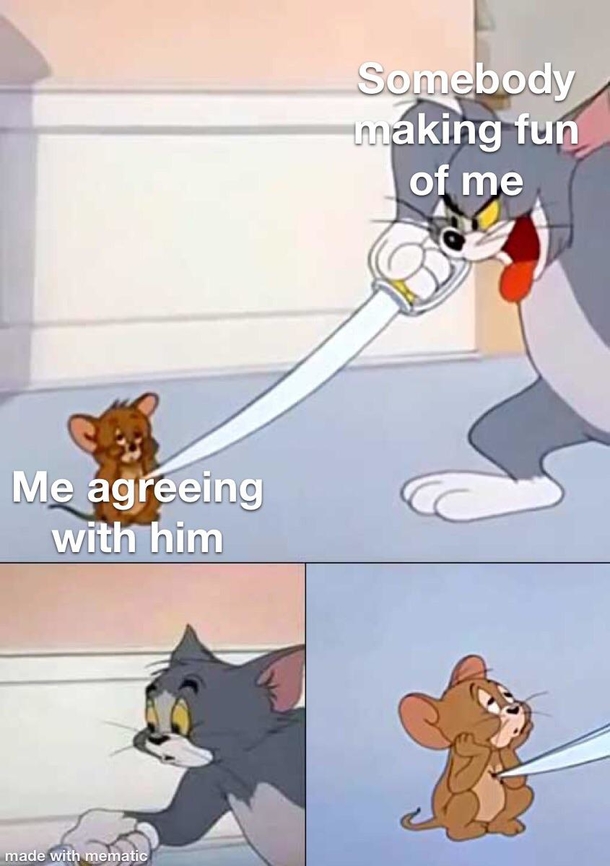
Where is `mouse`? mouse is located at coordinates (481, 782), (119, 440).